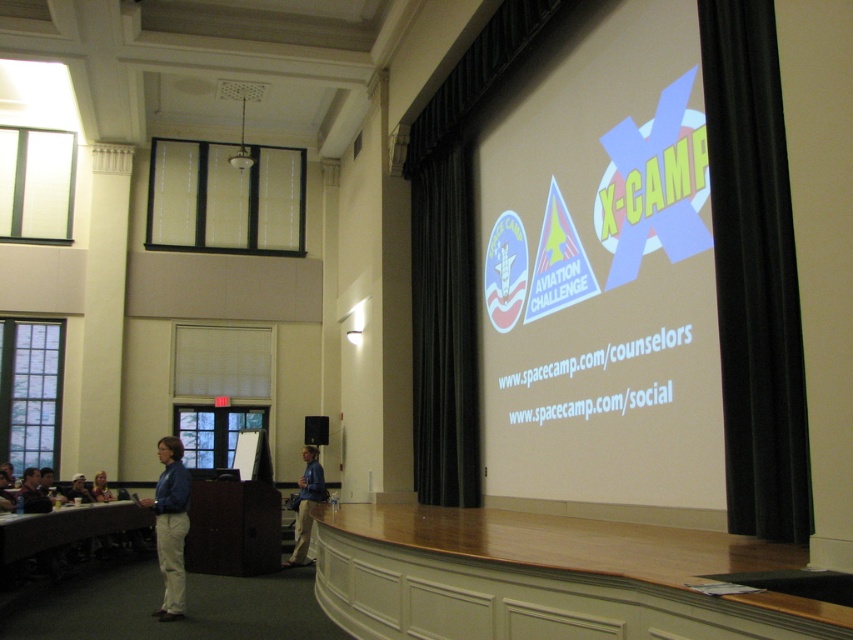
Question: Can you confirm if white matte projection screen at upper right is wider than blue shirt at center?

Choices:
 (A) no
 (B) yes

Answer: (B)

Question: Which point is closer to the camera taking this photo?

Choices:
 (A) (671, 22)
 (B) (71, 481)
 (C) (15, 499)
 (D) (93, 492)

Answer: (A)

Question: Does light brown wooden table at lower left appear under light blue shirt at lower left?

Choices:
 (A) yes
 (B) no

Answer: (B)

Question: Which of the following is the closest to the observer?

Choices:
 (A) (660, 340)
 (B) (4, 496)
 (C) (184, 509)
 (D) (306, 454)

Answer: (A)

Question: Does blue fabric shirt at left have a larger size compared to light blue shirt at lower left?

Choices:
 (A) yes
 (B) no

Answer: (A)

Question: Among these objects, which one is farthest from the camera?

Choices:
 (A) blue fabric shirt at left
 (B) white matte projection screen at upper right
 (C) light blue shirt at lower left
 (D) light brown wooden table at lower left

Answer: (C)